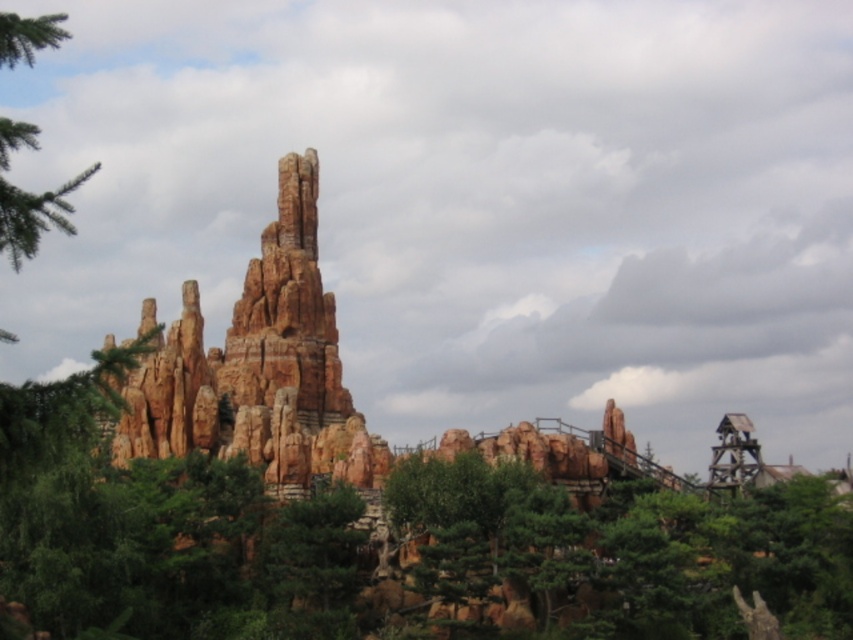
You are a hiker standing at the base of the rustic stone rock formation at center and want to take a photo of the green textured tree at upper left. To frame the tree properly in your shot, should you move to your left or right?

The rustic stone rock formation at center is to the right of the green textured tree at upper left, so to frame the tree properly, you should move to your left to position yourself further away from the rock formation and align with the tree.

You are a hiker standing at the bottom of the rustic stone rock formation at center. You want to reach the highest peak of the formation. Which direction should you move relative to your current position?

The highest peak of the rustic stone rock formation at center is located at point [259,368], so you should move towards that coordinate to reach it.